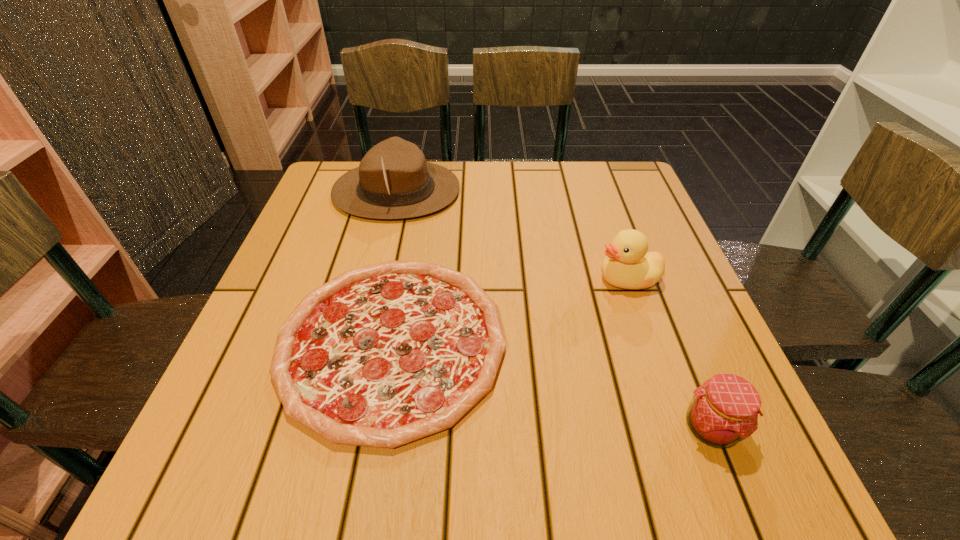
The image size is (960, 540). Find the location of `the farthest object`. the farthest object is located at coordinates (393, 181).

Identify the location of the tallest object. (393, 181).

Where is `duck`? duck is located at coordinates (628, 265).

The image size is (960, 540). I want to click on the second shortest object, so click(x=724, y=410).

Image resolution: width=960 pixels, height=540 pixels. Find the location of `the shortest object`. the shortest object is located at coordinates (383, 355).

Where is `vacant space situated on the feather side of the tallest object`? Image resolution: width=960 pixels, height=540 pixels. vacant space situated on the feather side of the tallest object is located at coordinates (560, 191).

At what (x,y) coordinates should I click in order to perform the action: click on vacant space located at the beak of the duck. Please return your answer as a coordinate pair (x, y). The image size is (960, 540). Looking at the image, I should click on (451, 279).

Identify the location of blank space located at the beak of the duck. The width and height of the screenshot is (960, 540). (422, 279).

This screenshot has width=960, height=540. Identify the location of vacant space located at the beak of the duck. (475, 279).

Locate an element on the screen. vacant region located 0.190m on the back of the third tallest object is located at coordinates (664, 312).